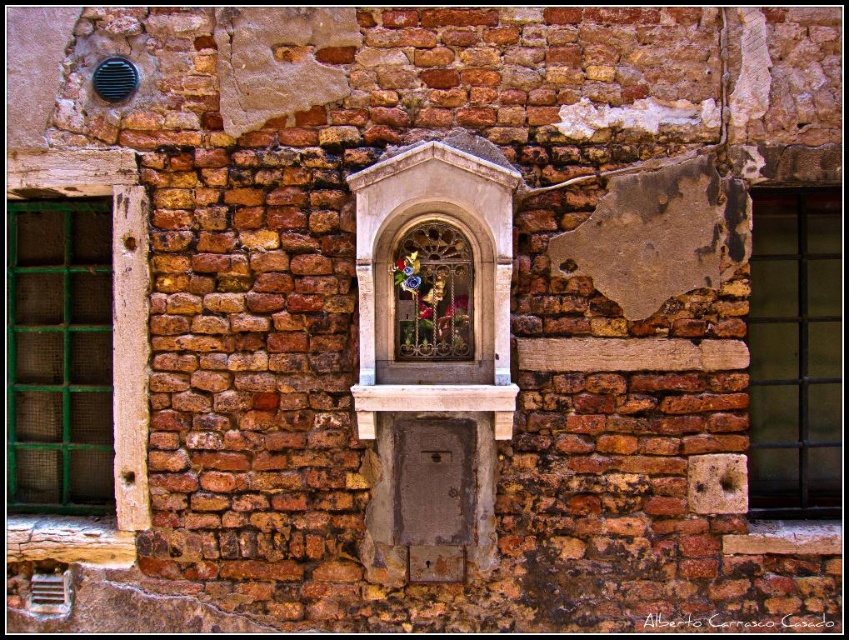
You are standing 10 feet away from the brick wall. A point at coordinates point [80,241] is located on the wall. Can you reach this point without moving closer to the wall?

The distance of point [80,241] from viewer is 14.34 feet, so you are currently 10 feet away from the wall. Since the point is 14.34 feet away from you, you would need to move 4.34 feet closer to the wall to reach it. Therefore, you cannot reach the point without moving closer to the wall.

You are standing in front of the brick wall and want to place a decorative plaque between the two points, point (13, 256) and point (763, 323). Based on their positions, which point is closer to you?

Point (13, 256) is behind point (763, 323), so the point closer to you is point (763, 323).

You are standing in front of the brick wall and want to locate the green mesh window at left. According to the coordinate system where the bottom left corner is the origin, can you tell me its position?

The green mesh window at left is located at coordinates point (59, 356).